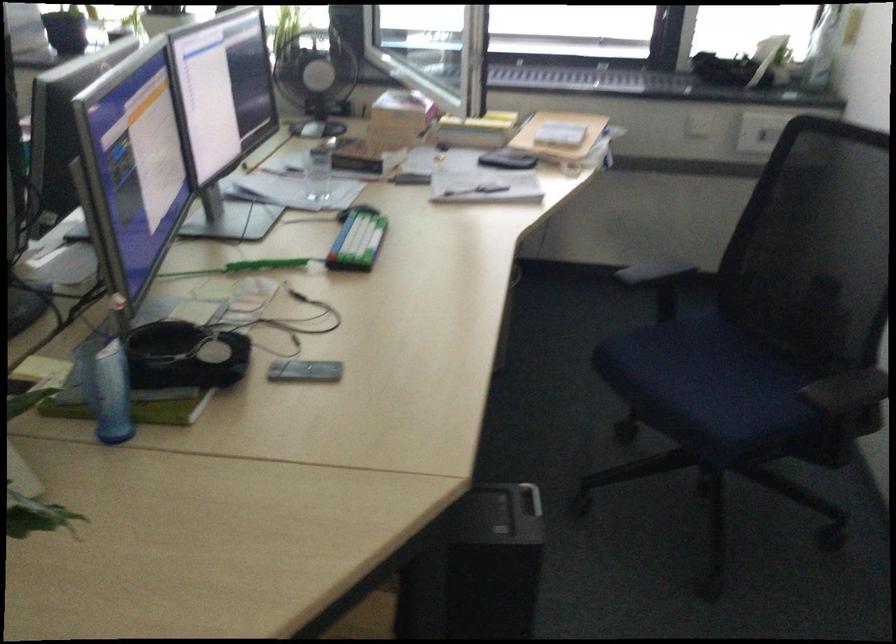
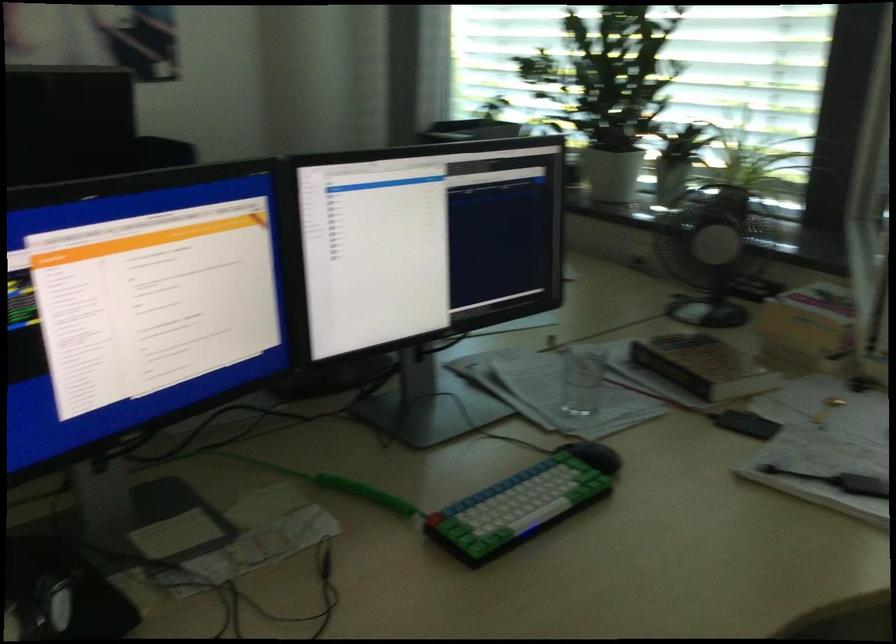
The point at (409, 120) is marked in the first image. Where is the corresponding point in the second image?

(810, 326)